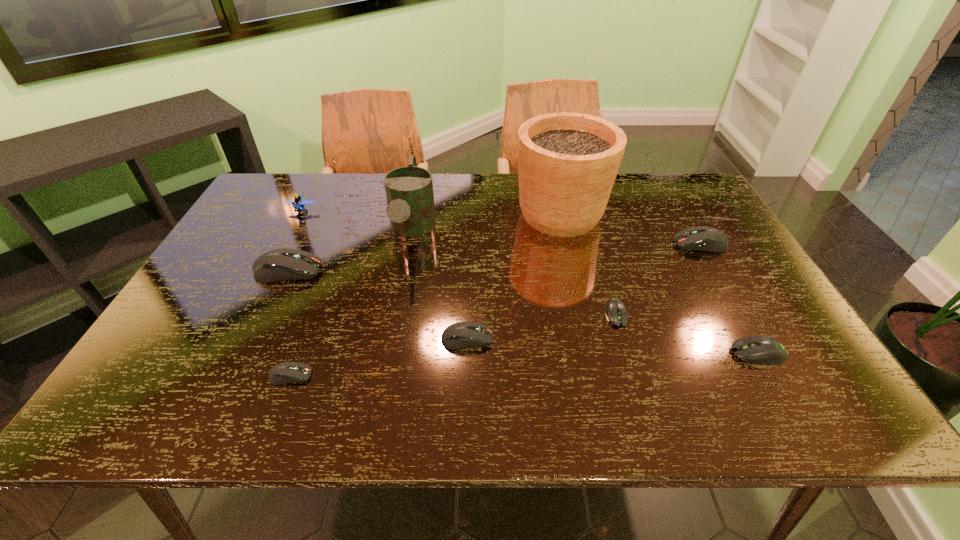
Locate an element on the screen. watering can that is at the far edge is located at coordinates (409, 190).

Locate an element on the screen. This screenshot has width=960, height=540. Lego that is at the far edge is located at coordinates (297, 203).

The width and height of the screenshot is (960, 540). I want to click on object at the near edge, so click(286, 372).

Locate an element on the screen. computer equipment at the left edge is located at coordinates (282, 264).

Find the location of `Lego present at the left edge`. Lego present at the left edge is located at coordinates (297, 203).

This screenshot has height=540, width=960. Identify the location of object situated at the far left corner. (297, 203).

The width and height of the screenshot is (960, 540). In the image, there is a desktop. In order to click on free space at the far edge in this screenshot , I will do `click(648, 212)`.

Find the location of `vacant space at the left edge of the desktop`. vacant space at the left edge of the desktop is located at coordinates (171, 332).

In the image, there is a desktop. Where is `vacant space at the right edge`? The image size is (960, 540). vacant space at the right edge is located at coordinates (732, 346).

The height and width of the screenshot is (540, 960). In the image, there is a desktop. In order to click on vacant space at the far left corner in this screenshot , I will do `click(274, 184)`.